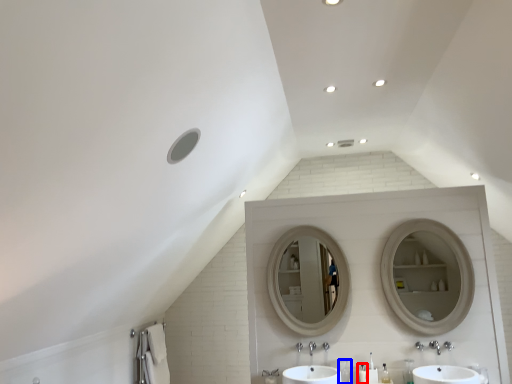
Question: Which point is closer to the camera, toiletry (highlighted by a red box) or toiletry (highlighted by a blue box)?

Choices:
 (A) toiletry
 (B) toiletry

Answer: (A)